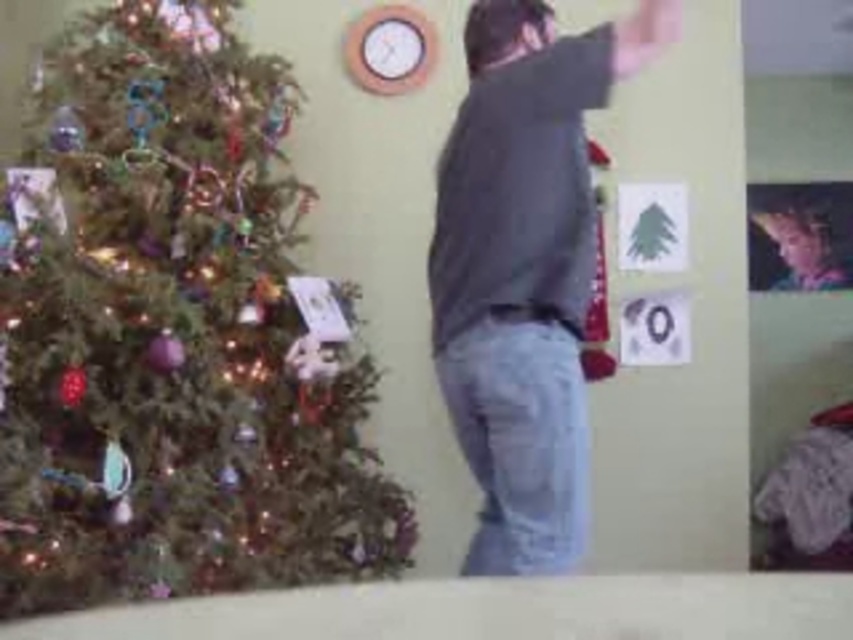
Can you confirm if shiny green tree at left is positioned to the right of dark gray hoodie at center?

In fact, shiny green tree at left is to the left of dark gray hoodie at center.

How much distance is there between shiny green tree at left and dark gray hoodie at center?

shiny green tree at left and dark gray hoodie at center are 23.62 inches apart from each other.

Is point (409, 508) positioned before point (537, 260)?

No, it is behind (537, 260).

You are a GUI agent. You are given a task and a screenshot of the screen. Output one action in this format:
    pyautogui.click(x=<x>, y=<y>)
    Task: Click on the shiny green tree at left
    This screenshot has width=853, height=640.
    Given the screenshot: What is the action you would take?
    pyautogui.click(x=172, y=333)